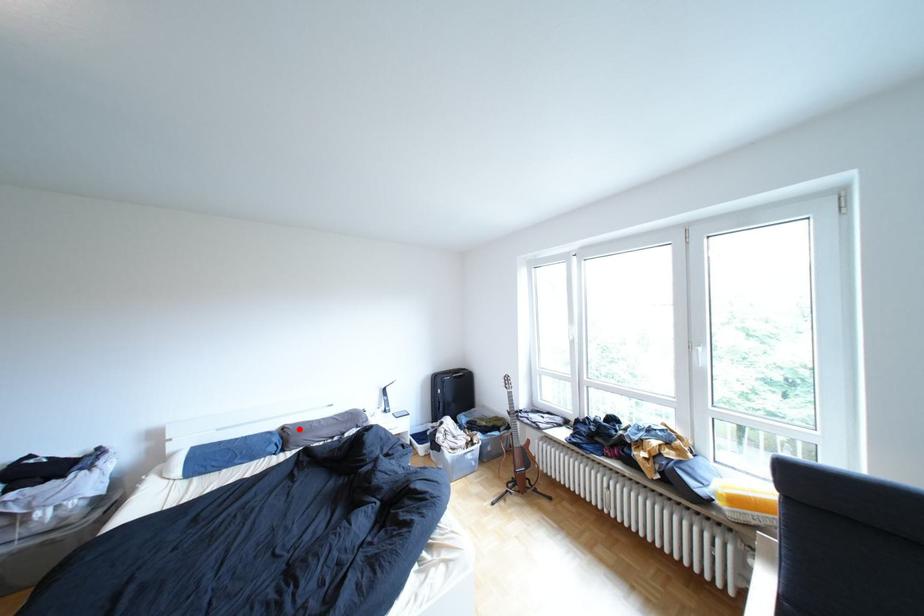
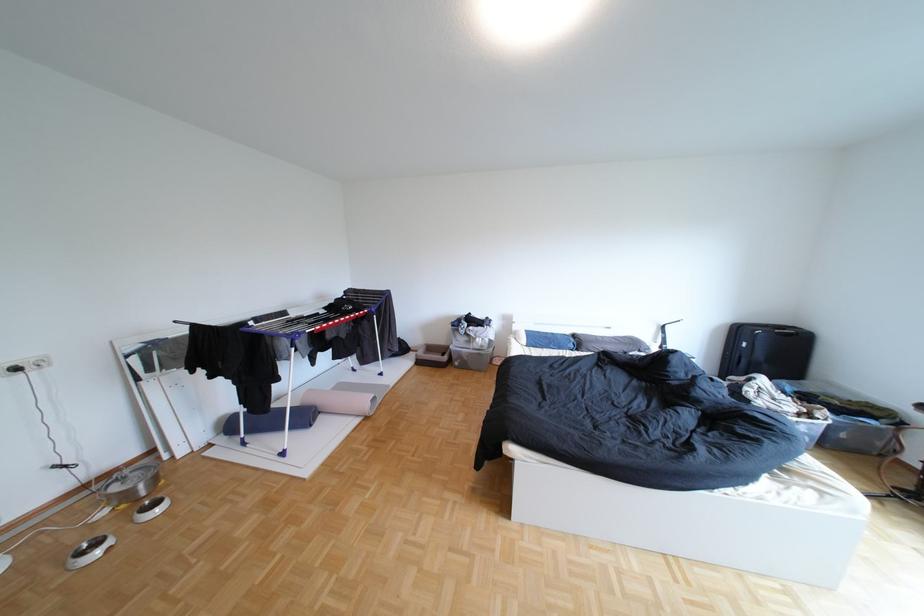
Find the pixel in the second image that matches the highlighted location in the first image.

(590, 336)